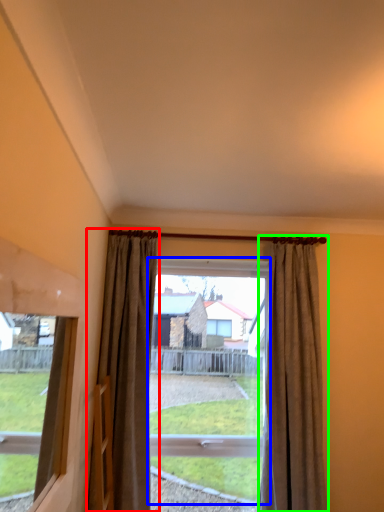
Question: Which object is the closest to the curtain (highlighted by a red box)? Choose among these: bay window (highlighted by a blue box) or curtain (highlighted by a green box).

Choices:
 (A) bay window
 (B) curtain

Answer: (B)